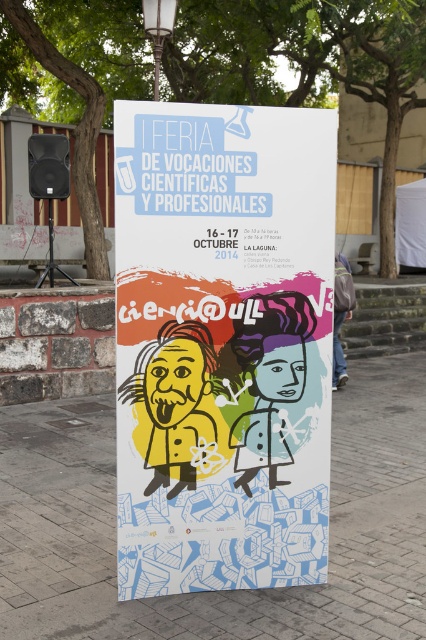
Question: Based on their relative distances, which object is nearer to the matte blue chef's jacket at center?

Choices:
 (A) matte yellow poster at center
 (B) yellow matte/soft einstein head at center

Answer: (A)

Question: In this image, where is matte yellow poster at center located relative to yellow matte/soft einstein head at center?

Choices:
 (A) above
 (B) below

Answer: (A)

Question: Which object is positioned farthest from the matte blue chef's jacket at center?

Choices:
 (A) matte yellow poster at center
 (B) denim jacket at lower right

Answer: (B)

Question: Can you confirm if brick pavement at center is smaller than yellow matte/soft einstein head at center?

Choices:
 (A) yes
 (B) no

Answer: (A)

Question: Estimate the real-world distances between objects in this image. Which object is farther from the matte blue chef's jacket at center?

Choices:
 (A) matte yellow poster at center
 (B) brick pavement at center

Answer: (B)

Question: Does matte yellow poster at center have a greater width compared to yellow matte/soft einstein head at center?

Choices:
 (A) yes
 (B) no

Answer: (A)